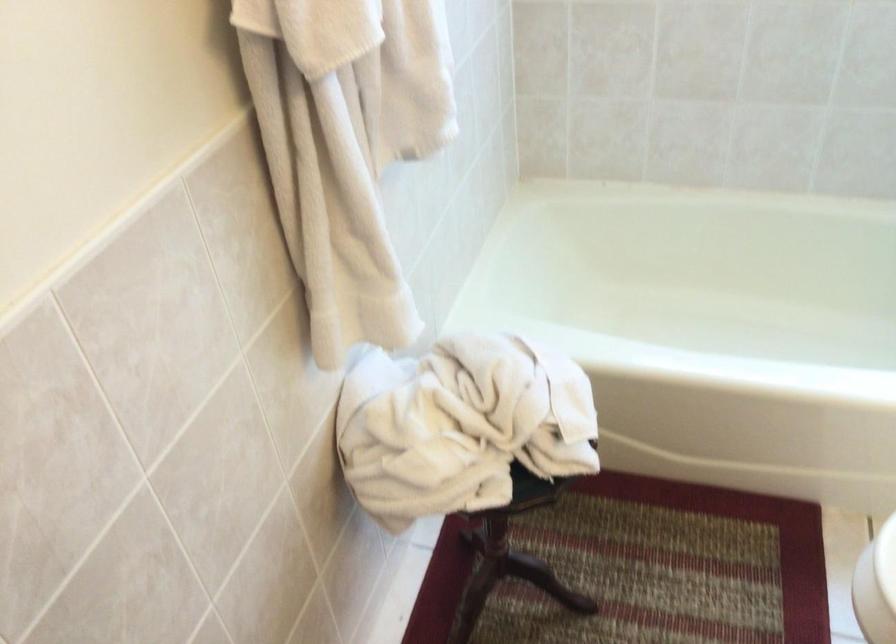
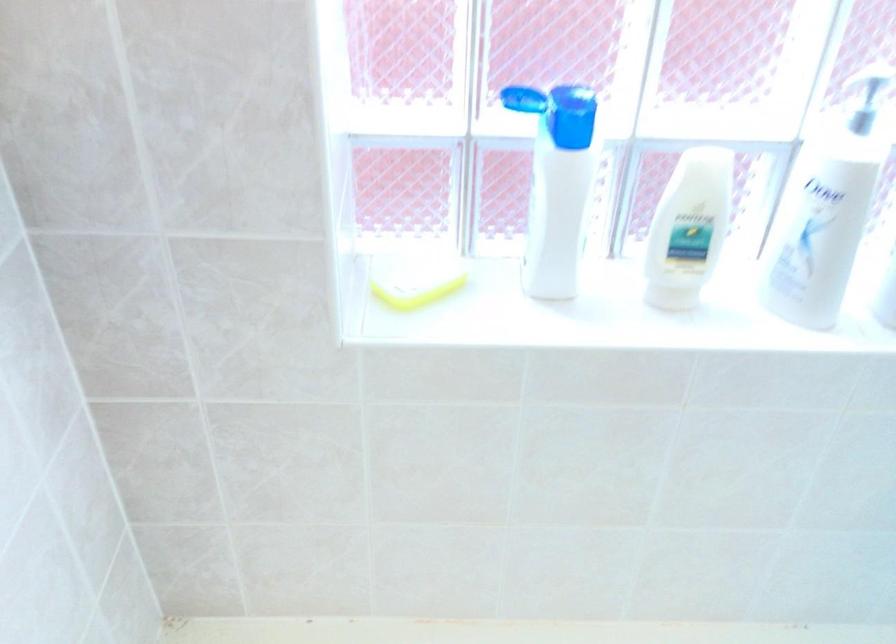
Question: The images are taken continuously from a first-person perspective. In which direction are you moving?

Choices:
 (A) Left
 (B) Right
 (C) Forward
 (D) Backward

Answer: (C)